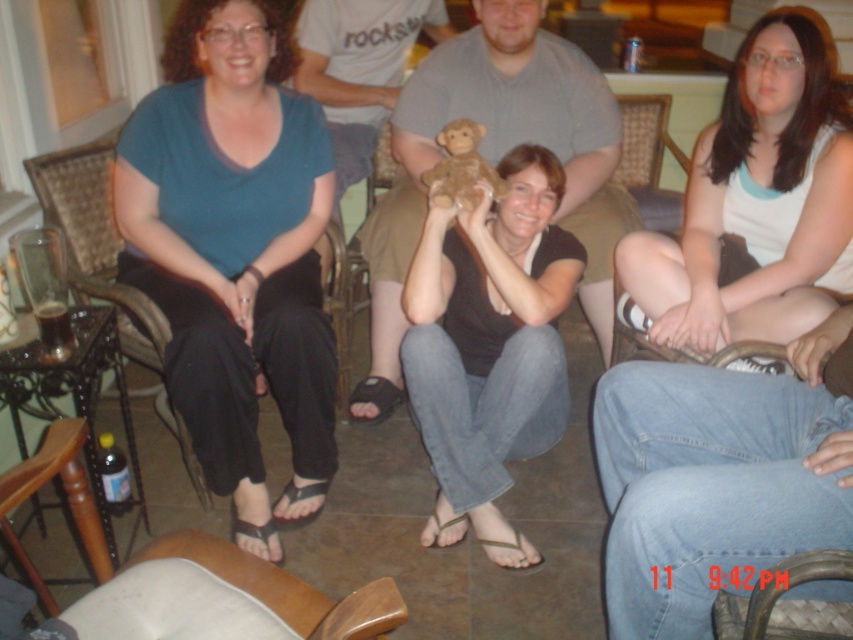
Question: Can you confirm if white cotton tank top at center is smaller than gray cotton shirt at center?

Choices:
 (A) yes
 (B) no

Answer: (A)

Question: Which point is closer to the camera?

Choices:
 (A) (79, 186)
 (B) (772, 52)
 (C) (454, 156)

Answer: (C)

Question: Is teal matte shirt at center below woven leather chair at lower center?

Choices:
 (A) yes
 (B) no

Answer: (B)

Question: Which of the following is the closest to the observer?

Choices:
 (A) (61, 182)
 (B) (368, 620)

Answer: (B)

Question: Which object is the closest to the white cotton tank top at center?

Choices:
 (A) black matte shirt at center
 (B) brown plush monkey at center
 (C) brown leather armchair at lower left

Answer: (A)

Question: Is woven leather chair at lower center bigger than brown plush monkey at center?

Choices:
 (A) yes
 (B) no

Answer: (B)